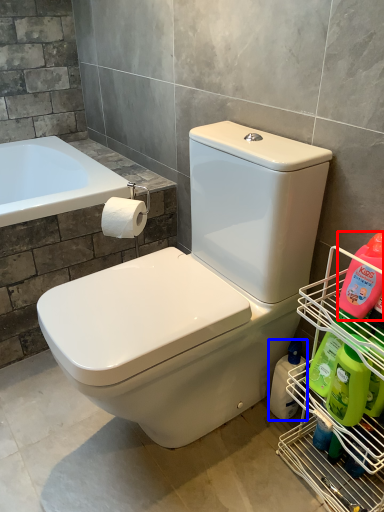
Question: Among these objects, which one is farthest to the camera, cleaning product (highlighted by a red box) or cleaning product (highlighted by a blue box)?

Choices:
 (A) cleaning product
 (B) cleaning product

Answer: (B)